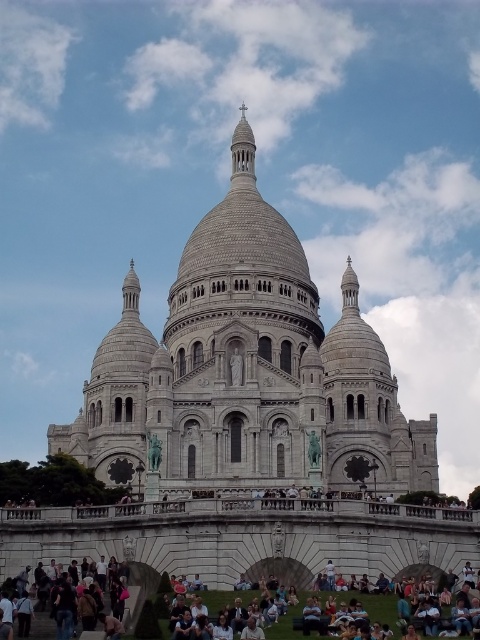
Does point (203, 460) come farther from viewer compared to point (285, 628)?

That is True.

What do you see at coordinates (248, 371) in the screenshot? I see `light gray stone cathedral at center` at bounding box center [248, 371].

Locate an element on the screen. The height and width of the screenshot is (640, 480). light gray stone cathedral at center is located at coordinates (248, 371).